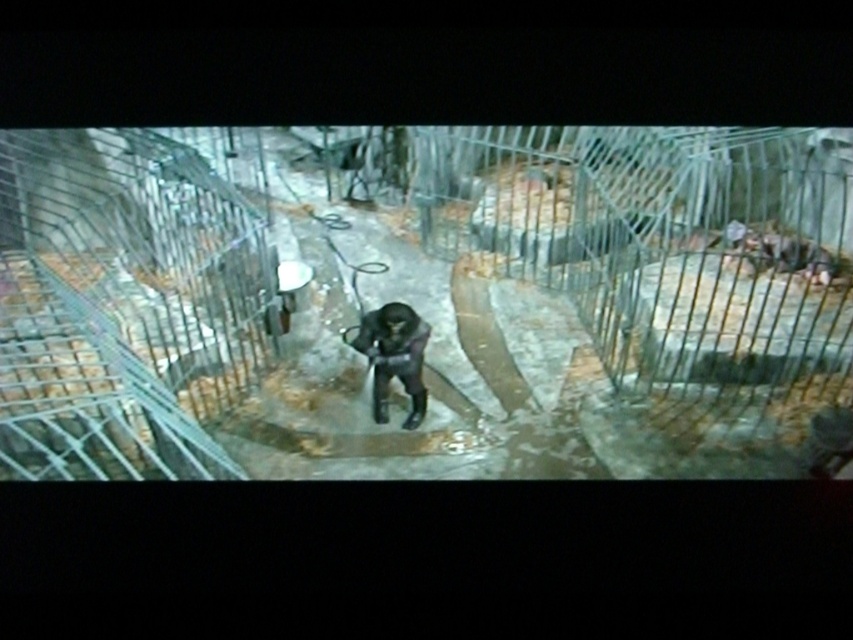
Question: Which object is farther from the camera taking this photo?

Choices:
 (A) smooth concrete floor at center
 (B) black matte gorilla at center

Answer: (B)

Question: From the image, what is the correct spatial relationship of smooth concrete floor at center in relation to black matte gorilla at center?

Choices:
 (A) above
 (B) below

Answer: (A)

Question: Is smooth concrete floor at center thinner than black matte gorilla at center?

Choices:
 (A) yes
 (B) no

Answer: (B)

Question: Is smooth concrete floor at center wider than black matte gorilla at center?

Choices:
 (A) no
 (B) yes

Answer: (B)

Question: Which point is farther to the camera?

Choices:
 (A) (254, 436)
 (B) (372, 385)

Answer: (B)